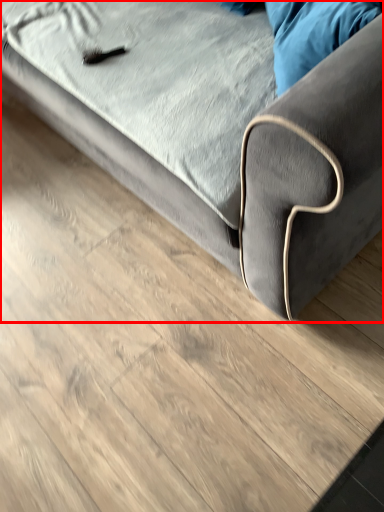
Question: Where is studio couch (annotated by the red box) located in relation to pillow in the image?

Choices:
 (A) left
 (B) right

Answer: (A)